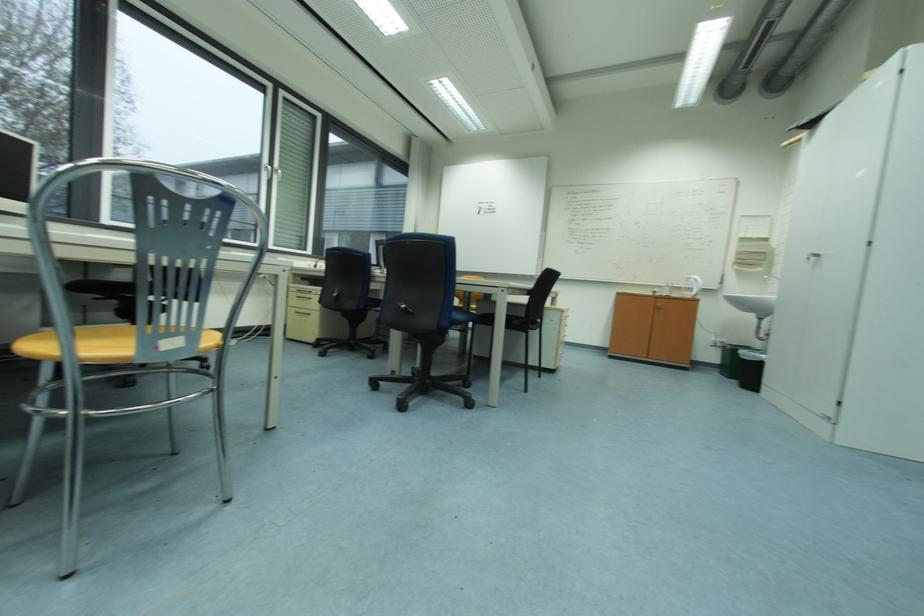
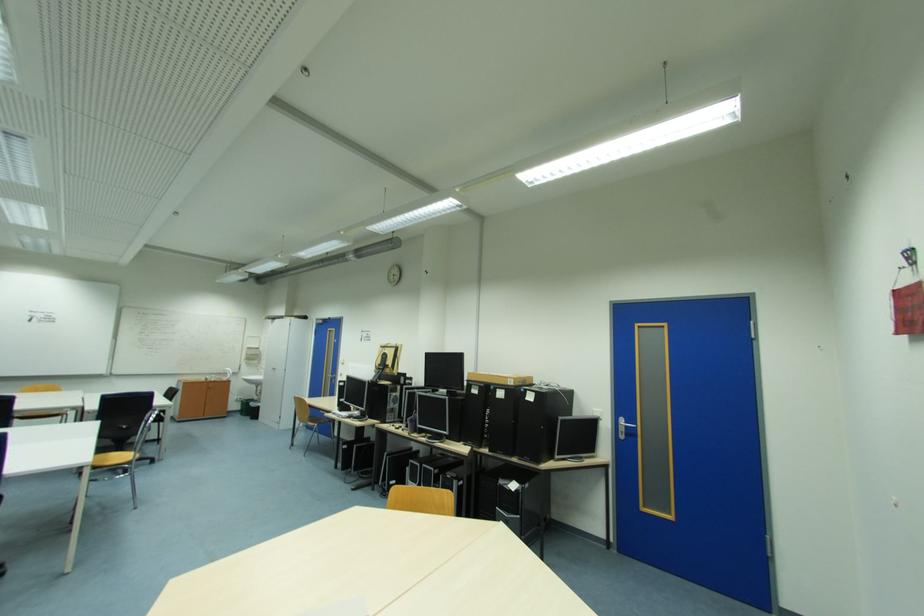
Locate, in the second image, the point that corresponds to point 732,376 in the first image.

(249, 416)